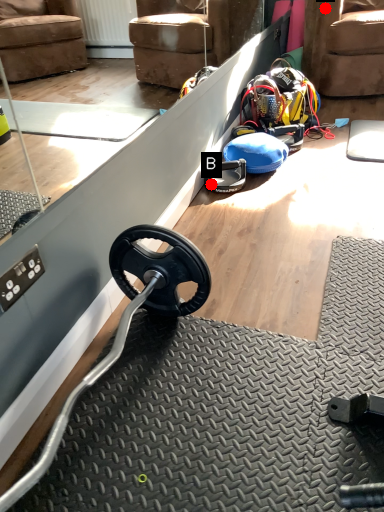
Question: Two points are circled on the image, labeled by A and B beside each circle. Which point is closer to the camera?

Choices:
 (A) A is closer
 (B) B is closer

Answer: (B)